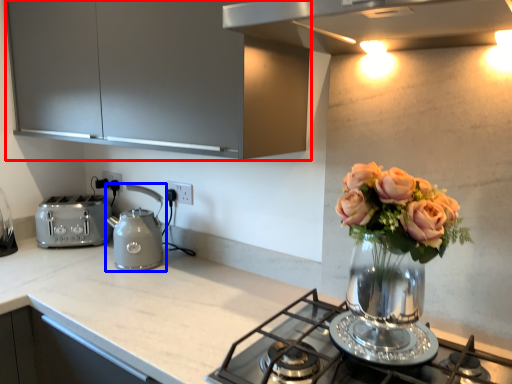
Question: Among these objects, which one is nearest to the camera, cabinetry (highlighted by a red box) or kettle (highlighted by a blue box)?

Choices:
 (A) cabinetry
 (B) kettle

Answer: (A)